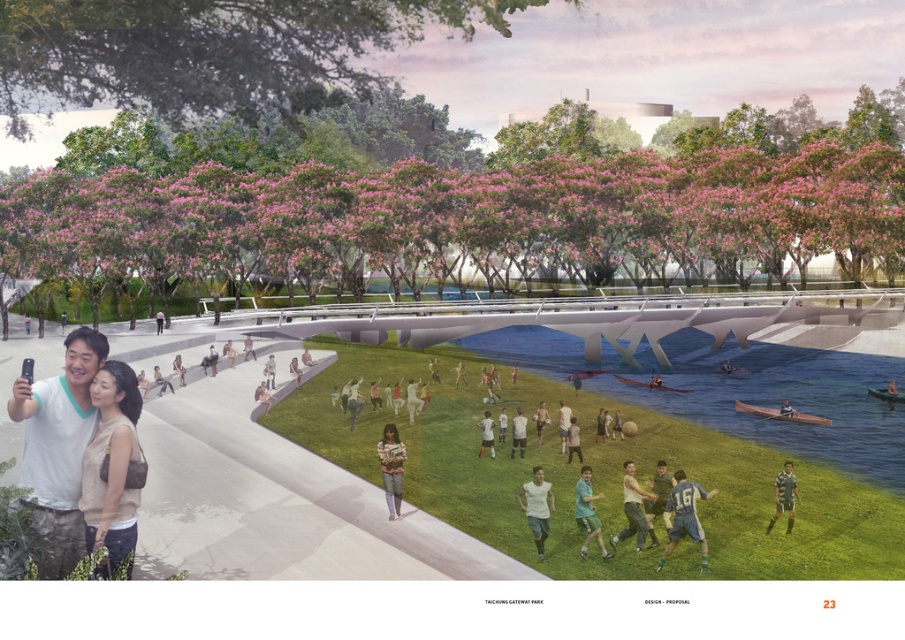
Does green leafy trees at center appear on the right side of gray fabric shirt at lower right?

No, green leafy trees at center is not to the right of gray fabric shirt at lower right.

Does point (197, 172) come behind point (784, 472)?

Yes, point (197, 172) is behind point (784, 472).

The height and width of the screenshot is (640, 905). I want to click on green leafy trees at center, so click(460, 224).

Can you confirm if light brown sweater at center is taller than gray fabric shirt at lower right?

Yes, light brown sweater at center is taller than gray fabric shirt at lower right.

Is light brown sweater at center above gray fabric shirt at lower right?

Indeed, light brown sweater at center is positioned over gray fabric shirt at lower right.

At what (x,y) coordinates should I click in order to perform the action: click on light brown sweater at center. Please return your answer as a coordinate pair (x, y). The image size is (905, 640). Looking at the image, I should click on (391, 467).

Locate an element on the screen. light brown sweater at center is located at coordinates (391, 467).

Image resolution: width=905 pixels, height=640 pixels. What do you see at coordinates (206, 49) in the screenshot?
I see `green leafy tree at upper center` at bounding box center [206, 49].

Who is positioned more to the left, green leafy tree at upper center or green jersey at center?

green leafy tree at upper center is more to the left.

This screenshot has height=640, width=905. Identify the location of green leafy tree at upper center. tap(206, 49).

Image resolution: width=905 pixels, height=640 pixels. I want to click on green leafy tree at upper center, so click(206, 49).